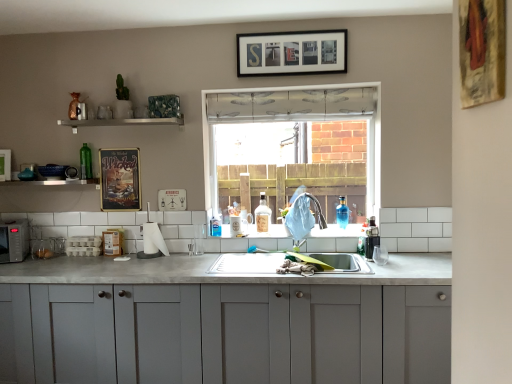
Question: Does blue glass bottle at sink, which appears as the 1th bottle when viewed from the right, have a greater height compared to white glossy shelf at upper center, which is the first window sill in right-to-left order?

Choices:
 (A) yes
 (B) no

Answer: (A)

Question: Is white glossy shelf at upper center, positioned as the 2th window sill in left-to-right order, at the back of blue glass bottle at sink, which appears as the third bottle when viewed from the left?

Choices:
 (A) yes
 (B) no

Answer: (B)

Question: Considering the relative sizes of blue glass bottle at sink, which appears as the 1th bottle when viewed from the right, and white glossy shelf at upper center, which ranks as the first window sill in top-to-bottom order, in the image provided, is blue glass bottle at sink, which appears as the 1th bottle when viewed from the right, wider than white glossy shelf at upper center, which ranks as the first window sill in top-to-bottom order,?

Choices:
 (A) no
 (B) yes

Answer: (A)

Question: Is blue glass bottle at sink, which appears as the third bottle when viewed from the left, completely or partially outside of white glossy shelf at upper center, which ranks as the first window sill in top-to-bottom order?

Choices:
 (A) no
 (B) yes

Answer: (B)

Question: From a real-world perspective, is blue glass bottle at sink, which appears as the 1th bottle when viewed from the right, located beneath white glossy shelf at upper center, positioned as the 2th window sill in left-to-right order?

Choices:
 (A) no
 (B) yes

Answer: (B)

Question: Is black matte microwave at left in front of or behind green glass bottle at upper left, acting as the third bottle starting from the right, in the image?

Choices:
 (A) front
 (B) behind

Answer: (A)

Question: From their relative heights in the image, would you say black matte microwave at left is taller or shorter than green glass bottle at upper left, acting as the third bottle starting from the right?

Choices:
 (A) short
 (B) tall

Answer: (A)

Question: From the image's perspective, is black matte microwave at left above or below green glass bottle at upper left, which is counted as the first bottle, starting from the left?

Choices:
 (A) below
 (B) above

Answer: (A)

Question: In terms of width, does black matte microwave at left look wider or thinner when compared to green glass bottle at upper left, acting as the third bottle starting from the right?

Choices:
 (A) thin
 (B) wide

Answer: (B)

Question: From a real-world perspective, relative to clear glass bottle at sink, the second bottle in the left-to-right sequence, is black matte picture frame at upper center, which appears as the 3th picture frame when ordered from the bottom, vertically above or below?

Choices:
 (A) below
 (B) above

Answer: (B)

Question: Is black matte picture frame at upper center, the 2th picture frame from the right, inside or outside of clear glass bottle at sink, the second bottle in the left-to-right sequence?

Choices:
 (A) inside
 (B) outside

Answer: (B)

Question: Relative to clear glass bottle at sink, the 2th bottle in the right-to-left sequence, is black matte picture frame at upper center, the 2th picture frame from the right, in front or behind?

Choices:
 (A) front
 (B) behind

Answer: (A)

Question: Looking at the image, does black matte picture frame at upper center, which appears as the 3th picture frame when ordered from the bottom, seem bigger or smaller compared to clear glass bottle at sink, the second bottle in the left-to-right sequence?

Choices:
 (A) big
 (B) small

Answer: (A)

Question: Considering their positions, is white glossy shelf at upper center, which is counted as the 2th window sill, starting from the bottom, located in front of or behind blue glass bottle at sink, which appears as the third bottle when viewed from the left?

Choices:
 (A) behind
 (B) front

Answer: (B)

Question: Is point (73, 119) closer or farther from the camera than point (340, 226)?

Choices:
 (A) closer
 (B) farther

Answer: (A)